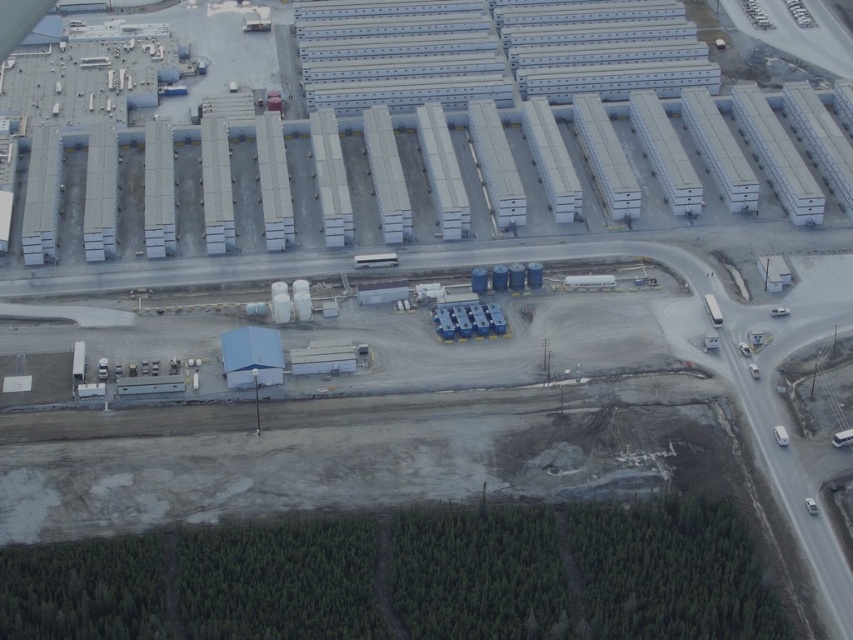
Question: Does white corrugated metal warehouse at upper center have a lesser width compared to white corrugated metal containers at upper center?

Choices:
 (A) no
 (B) yes

Answer: (A)

Question: Does white corrugated metal warehouse at upper center have a smaller size compared to white corrugated metal containers at upper center?

Choices:
 (A) no
 (B) yes

Answer: (A)

Question: Which point is closer to the camera?

Choices:
 (A) click(331, 124)
 (B) click(431, 56)

Answer: (A)

Question: In this image, where is white corrugated metal warehouse at upper center located relative to white corrugated metal containers at upper center?

Choices:
 (A) right
 (B) left

Answer: (B)

Question: Which of the following is the closest to the observer?

Choices:
 (A) (608, 77)
 (B) (44, 150)

Answer: (B)